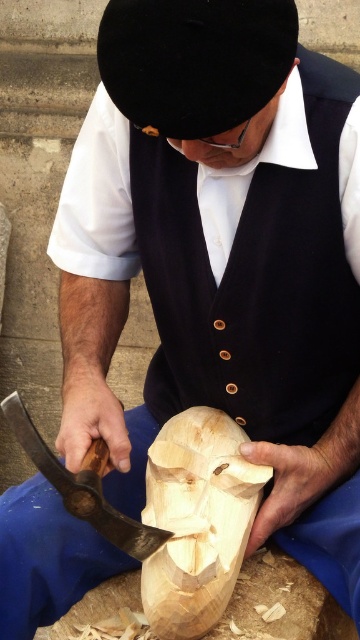
Question: Which of the following is the closest to the observer?

Choices:
 (A) navy blue fabric vest at center
 (B) natural wood mask at center
 (C) black velvet hat at upper center
 (D) wooden axe at center

Answer: (C)

Question: Based on their relative distances, which object is nearer to the black velvet hat at upper center?

Choices:
 (A) navy blue fabric vest at center
 (B) wooden axe at center
 (C) natural wood mask at center

Answer: (A)

Question: Considering the relative positions of navy blue fabric vest at center and natural wood mask at center in the image provided, where is navy blue fabric vest at center located with respect to natural wood mask at center?

Choices:
 (A) below
 (B) above

Answer: (B)

Question: Can you confirm if navy blue fabric vest at center is wider than wooden axe at center?

Choices:
 (A) no
 (B) yes

Answer: (B)

Question: Is black velvet hat at upper center in front of natural wood mask at center?

Choices:
 (A) yes
 (B) no

Answer: (A)

Question: Among these points, which one is nearest to the camera?

Choices:
 (A) (178, 428)
 (B) (78, 513)

Answer: (B)